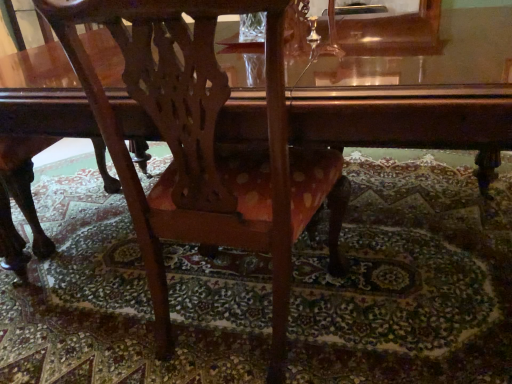
Question: Based on their positions, is matte wood chair at center located to the left or right of glossy wood table at center?

Choices:
 (A) left
 (B) right

Answer: (A)

Question: Looking at the image, does matte wood chair at center seem bigger or smaller compared to glossy wood table at center?

Choices:
 (A) big
 (B) small

Answer: (B)

Question: From their relative heights in the image, would you say matte wood chair at center is taller or shorter than glossy wood table at center?

Choices:
 (A) tall
 (B) short

Answer: (A)

Question: Is glossy wood table at center bigger or smaller than matte wood chair at center?

Choices:
 (A) small
 (B) big

Answer: (B)

Question: In terms of width, does glossy wood table at center look wider or thinner when compared to matte wood chair at center?

Choices:
 (A) thin
 (B) wide

Answer: (B)

Question: In terms of height, does glossy wood table at center look taller or shorter compared to matte wood chair at center?

Choices:
 (A) short
 (B) tall

Answer: (A)

Question: In the image, is glossy wood table at center on the left side or the right side of matte wood chair at center?

Choices:
 (A) right
 (B) left

Answer: (A)